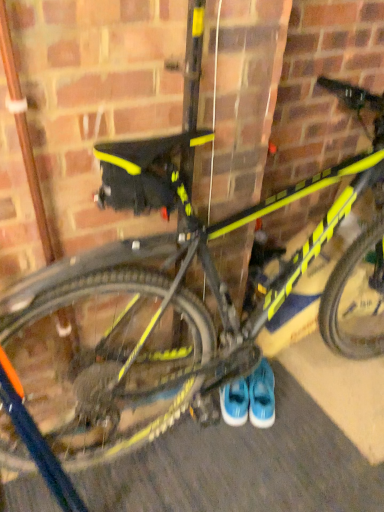
You are a GUI agent. You are given a task and a screenshot of the screen. Output one action in this format:
    pyautogui.click(x=<x>, y=<y>)
    Task: Click on the free spot to the right of blue suede sneakers at center, which ranks as the second footwear in left-to-right order
    
    Given the screenshot: What is the action you would take?
    pyautogui.click(x=302, y=391)